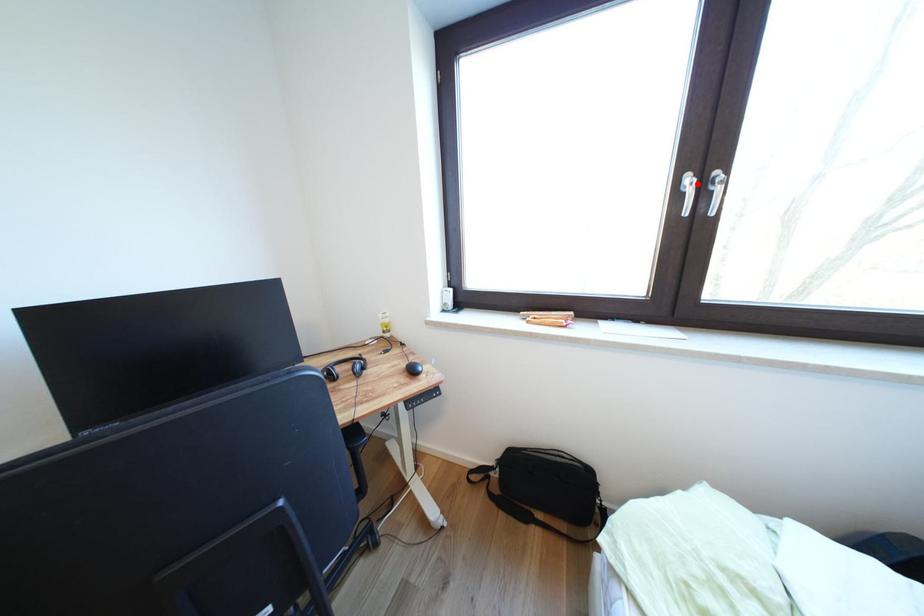
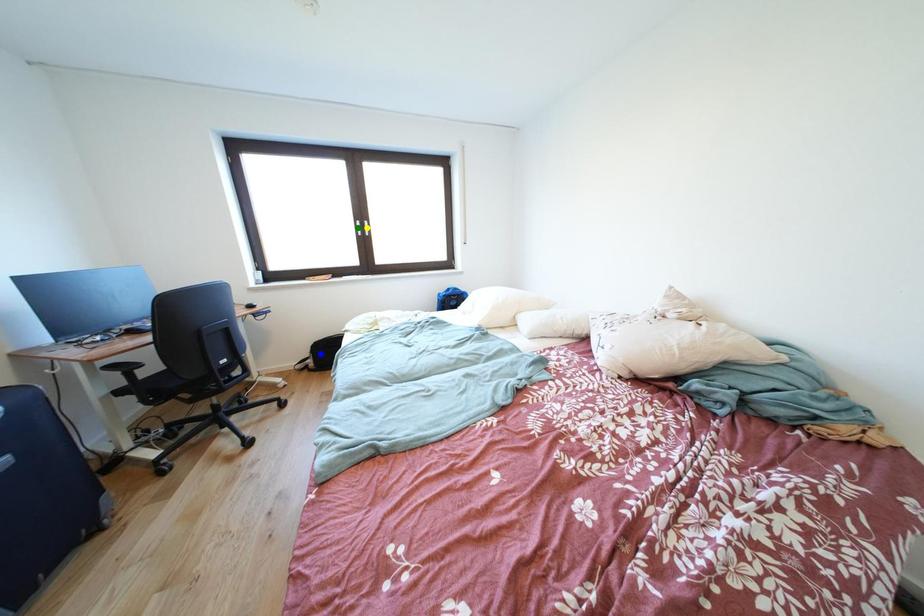
Question: I am providing you with two images of the same scene from different viewpoints. A red point is marked on the first image. You are given multiple points on the second image. Which spot in image 2 lines up with the point in image 1?

Choices:
 (A) blue point
 (B) yellow point
 (C) green point

Answer: (B)